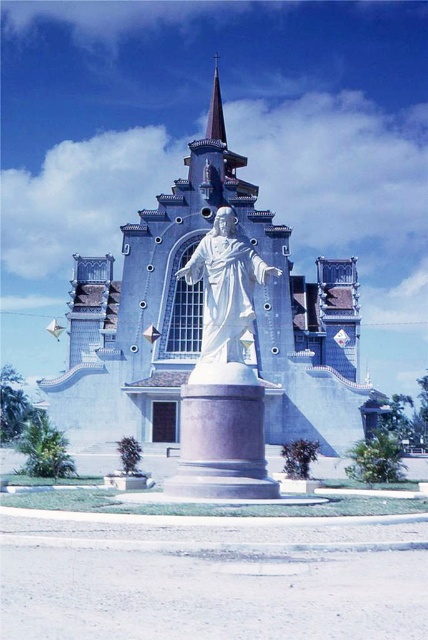
Is white stone church at center to the left of purple glass spire at upper center from the viewer's perspective?

Yes, white stone church at center is to the left of purple glass spire at upper center.

Does point (74, 282) come behind point (216, 65)?

No.

This screenshot has width=428, height=640. What are the coordinates of `white stone church at center` in the screenshot? It's located at (201, 324).

Does white polished stone pedestal at center come behind white marble statue at center?

No, it is not.

Does white polished stone pedestal at center have a greater height compared to white marble statue at center?

In fact, white polished stone pedestal at center may be shorter than white marble statue at center.

Who is more forward, (190, 410) or (232, 280)?

Point (190, 410)

Identify the location of white polished stone pedestal at center. The height and width of the screenshot is (640, 428). (222, 444).

Does white stone church at center have a lesser width compared to white polished stone pedestal at center?

Incorrect, white stone church at center's width is not less than white polished stone pedestal at center's.

Is point (262, 224) positioned behind point (261, 490)?

Yes, it is.

The width and height of the screenshot is (428, 640). In order to click on white stone church at center in this screenshot , I will do `click(201, 324)`.